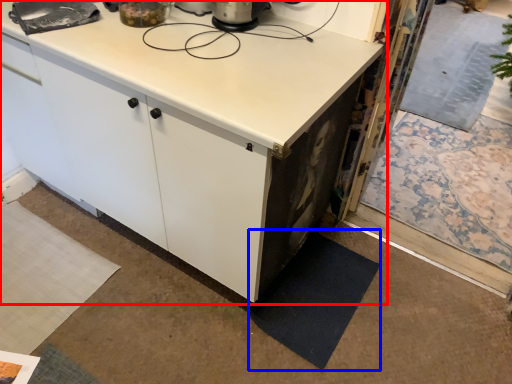
Question: Which point is closer to the camera, cabinetry (highlighted by a red box) or mat (highlighted by a blue box)?

Choices:
 (A) cabinetry
 (B) mat

Answer: (A)